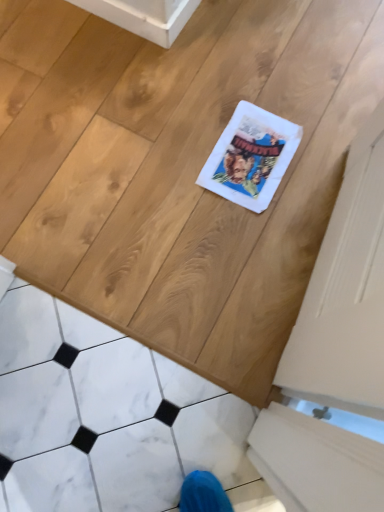
Question: Should I look upward or downward to see white matte screen door at right?

Choices:
 (A) up
 (B) down

Answer: (A)

Question: Does white matte screen door at right appear on the left side of white marble tile at lower left?

Choices:
 (A) yes
 (B) no

Answer: (B)

Question: Considering the relative sizes of white matte screen door at right and white marble tile at lower left in the image provided, is white matte screen door at right smaller than white marble tile at lower left?

Choices:
 (A) no
 (B) yes

Answer: (B)

Question: From a real-world perspective, does white matte screen door at right sit lower than white marble tile at lower left?

Choices:
 (A) no
 (B) yes

Answer: (B)

Question: Does white matte screen door at right have a greater height compared to white marble tile at lower left?

Choices:
 (A) yes
 (B) no

Answer: (B)

Question: Is there a large distance between white matte screen door at right and white marble tile at lower left?

Choices:
 (A) no
 (B) yes

Answer: (A)

Question: Would you say white marble tile at lower left is part of white matte screen door at right's contents?

Choices:
 (A) no
 (B) yes

Answer: (A)

Question: Does white marble tile at lower left have a greater width compared to white matte screen door at right?

Choices:
 (A) no
 (B) yes

Answer: (B)

Question: From the image's perspective, is white marble tile at lower left above white matte screen door at right?

Choices:
 (A) no
 (B) yes

Answer: (A)

Question: From a real-world perspective, is white marble tile at lower left on top of white matte screen door at right?

Choices:
 (A) yes
 (B) no

Answer: (A)

Question: Is white marble tile at lower left not near white matte screen door at right?

Choices:
 (A) yes
 (B) no

Answer: (B)

Question: Can you confirm if white marble tile at lower left is thinner than white matte screen door at right?

Choices:
 (A) no
 (B) yes

Answer: (A)

Question: From a real-world perspective, is white marble tile at lower left physically below white matte screen door at right?

Choices:
 (A) no
 (B) yes

Answer: (A)

Question: Considering the positions of point (380, 450) and point (61, 440), is point (380, 450) closer or farther from the camera than point (61, 440)?

Choices:
 (A) farther
 (B) closer

Answer: (B)